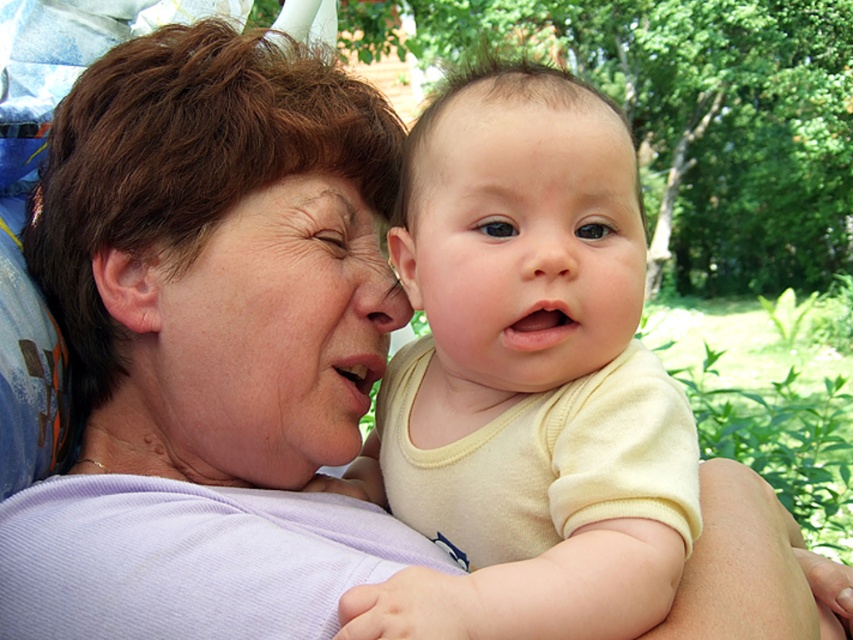
Question: Which of the following is the closest to the observer?

Choices:
 (A) (456, 314)
 (B) (331, 221)

Answer: (A)

Question: Does smooth skin at center appear over smooth skin nose at center?

Choices:
 (A) no
 (B) yes

Answer: (B)

Question: Which is nearer to the smooth cream baby at center?

Choices:
 (A) matte skin nose at center
 (B) smooth skin face at center
 (C) smooth cream shirt at center

Answer: (C)

Question: Does smooth skin at center appear on the right side of matte skin nose at center?

Choices:
 (A) no
 (B) yes

Answer: (B)

Question: Which point is closer to the camera?

Choices:
 (A) (337, 364)
 (B) (585, 300)
 (C) (561, 227)
 (D) (589, 108)

Answer: (B)

Question: Can you confirm if smooth cream shirt at center is bigger than smooth skin face at center?

Choices:
 (A) yes
 (B) no

Answer: (A)